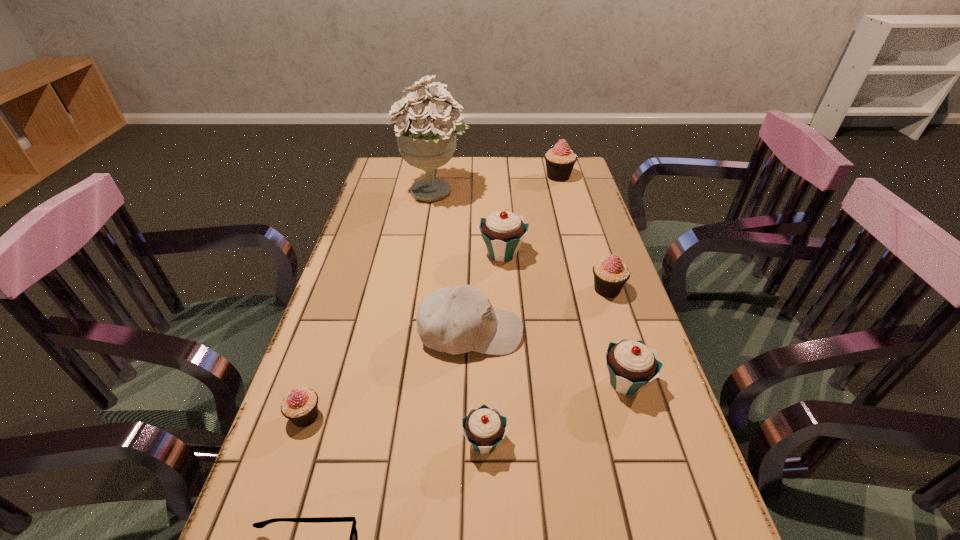
Where is `vacant space at the left edge`? vacant space at the left edge is located at coordinates (357, 265).

In order to click on vacant region at the right edge in this screenshot , I will do (x=714, y=525).

Identify the location of vacant region at the far right corner. Image resolution: width=960 pixels, height=540 pixels. (579, 187).

At what (x,y) coordinates should I click in order to perform the action: click on vacant space that is in between the biggest pink cupcake and the second farthest cupcake. Please return your answer as a coordinate pair (x, y). The image size is (960, 540). Looking at the image, I should click on (530, 215).

This screenshot has width=960, height=540. What are the coordinates of `free spot between the farthest cupcake and the second nearest teal cupcake` in the screenshot? It's located at (591, 279).

Where is `free space between the nearest teal cupcake and the rightmost teal cupcake`? Image resolution: width=960 pixels, height=540 pixels. free space between the nearest teal cupcake and the rightmost teal cupcake is located at coordinates (555, 412).

The height and width of the screenshot is (540, 960). Identify the location of free space between the leftmost pink cupcake and the second biggest teal cupcake. (466, 399).

I want to click on free point between the gray baseball cap and the third farthest object, so click(487, 293).

You are a GUI agent. You are given a task and a screenshot of the screen. Output one action in this format:
    pyautogui.click(x=<x>, y=<y>)
    Task: Click on the empty location between the nearest teal cupcake and the baseball cap
    
    Given the screenshot: What is the action you would take?
    pyautogui.click(x=477, y=387)

Select which object is the sixth closest to the green bouquet. Please provide its 2D coordinates. Your answer should be formatted as a tuple, i.e. [(x, y)], where the tuple contains the x and y coordinates of a point satisfying the conditions above.

[(300, 406)]